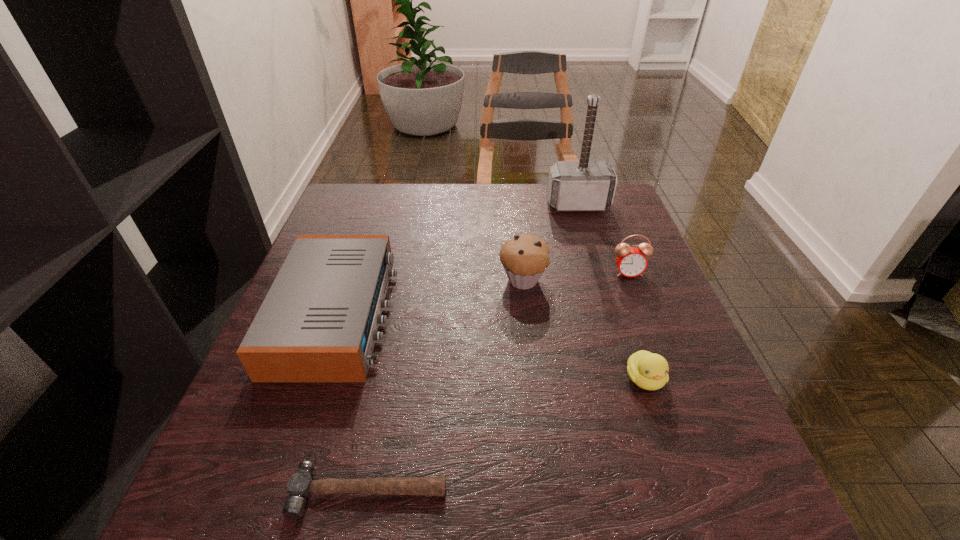
Where is `object located at the near left corner`? This screenshot has width=960, height=540. object located at the near left corner is located at coordinates (300, 486).

At what (x,y) coordinates should I click in order to perform the action: click on object located in the far right corner section of the desktop. Please return your answer as a coordinate pair (x, y). The width and height of the screenshot is (960, 540). Looking at the image, I should click on (586, 185).

The width and height of the screenshot is (960, 540). I want to click on vacant space at the far edge of the desktop, so click(493, 191).

What are the coordinates of `vacant space at the near edge of the desktop` in the screenshot? It's located at (570, 505).

The height and width of the screenshot is (540, 960). Find the location of `free location at the right edge of the desktop`. free location at the right edge of the desktop is located at coordinates (682, 328).

Identify the location of free region at the near left corner of the desktop. 287,526.

Identify the location of blank space at the far right corner of the desktop. This screenshot has height=540, width=960. (606, 221).

The width and height of the screenshot is (960, 540). Identify the location of vacant space at the near right corner of the desktop. (725, 481).

This screenshot has height=540, width=960. I want to click on free space between the left hammer and the tallest object, so click(473, 348).

The width and height of the screenshot is (960, 540). In order to click on vacant space that is in between the fourth object from right to left and the radio receiver in this screenshot , I will do `click(430, 298)`.